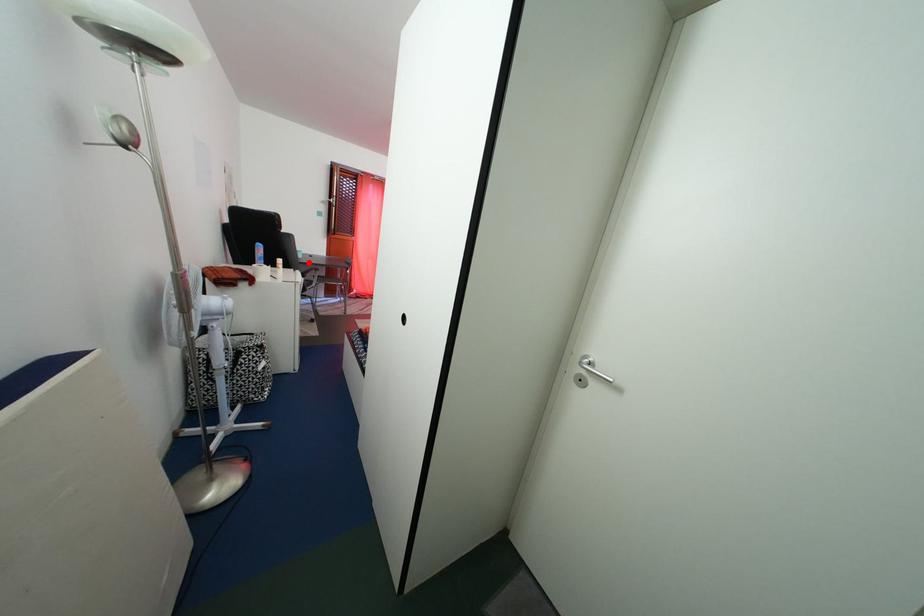
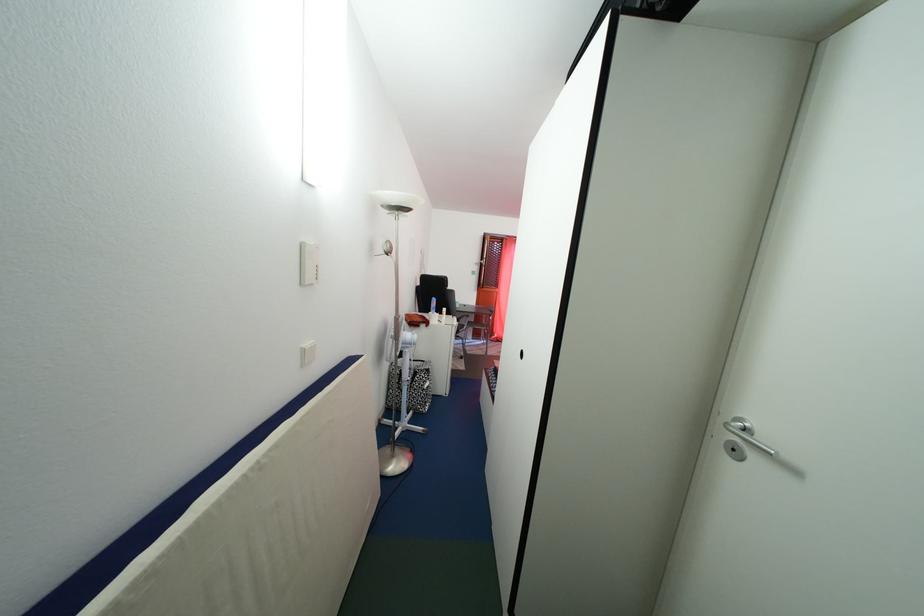
Where in the second image is the point corresponding to the highlighted location from the first image?

(466, 313)